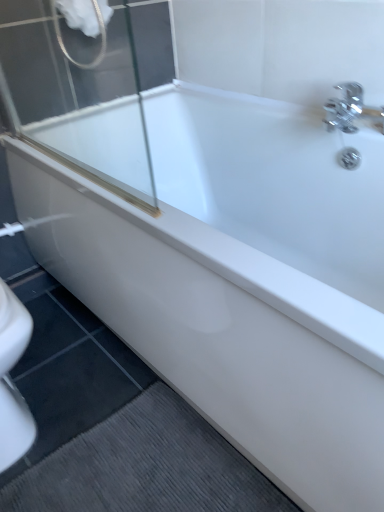
Locate an element on the screen. gray textured bath mat at lower left is located at coordinates pyautogui.click(x=146, y=466).

This screenshot has width=384, height=512. What do you see at coordinates (146, 466) in the screenshot? I see `gray textured bath mat at lower left` at bounding box center [146, 466].

Describe the element at coordinates (100, 32) in the screenshot. I see `white matte shower head at upper left` at that location.

At what (x,y) coordinates should I click in order to perform the action: click on white matte shower head at upper left. Please return your answer as a coordinate pair (x, y). Looking at the image, I should click on (100, 32).

The height and width of the screenshot is (512, 384). What are the coordinates of `gray textured bath mat at lower left` in the screenshot? It's located at (146, 466).

Considering the relative positions of white matte shower head at upper left and gray textured bath mat at lower left in the image provided, is white matte shower head at upper left to the right of gray textured bath mat at lower left from the viewer's perspective?

No.

Relative to gray textured bath mat at lower left, is white matte shower head at upper left in front or behind?

white matte shower head at upper left is behind gray textured bath mat at lower left.

Is point (56, 34) closer or farther from the camera than point (163, 479)?

Point (56, 34) appears to be farther away from the viewer than point (163, 479).

From the image's perspective, which one is positioned lower, white matte shower head at upper left or gray textured bath mat at lower left?

From the image's view, gray textured bath mat at lower left is below.

From a real-world perspective, which object rests below the other?

From a 3D spatial view, gray textured bath mat at lower left is below.

Looking at their sizes, would you say white matte shower head at upper left is wider or thinner than gray textured bath mat at lower left?

Clearly, white matte shower head at upper left has less width compared to gray textured bath mat at lower left.

Is white matte shower head at upper left taller than gray textured bath mat at lower left?

Indeed, white matte shower head at upper left has a greater height compared to gray textured bath mat at lower left.

Looking at the image, does white matte shower head at upper left seem bigger or smaller compared to gray textured bath mat at lower left?

white matte shower head at upper left is bigger than gray textured bath mat at lower left.

Based on the photo, do you think white matte shower head at upper left is within gray textured bath mat at lower left, or outside of it?

white matte shower head at upper left cannot be found inside gray textured bath mat at lower left.

Is white matte shower head at upper left not near gray textured bath mat at lower left?

That's right, there is a large distance between white matte shower head at upper left and gray textured bath mat at lower left.

Is white matte shower head at upper left facing towards gray textured bath mat at lower left?

No, white matte shower head at upper left is not turned towards gray textured bath mat at lower left.

How many degrees apart are the facing directions of white matte shower head at upper left and gray textured bath mat at lower left?

There is a 91.6-degree angle between the facing directions of white matte shower head at upper left and gray textured bath mat at lower left.

How distant is white matte shower head at upper left from gray textured bath mat at lower left?

1.23 meters.

Where is `shower above the gray textured bath mat at lower left (from the image's perspective)`? The image size is (384, 512). shower above the gray textured bath mat at lower left (from the image's perspective) is located at coordinates (100, 32).

From the picture: Which object is positioned more to the right, gray textured bath mat at lower left or white matte shower head at upper left?

Positioned to the right is gray textured bath mat at lower left.

Is gray textured bath mat at lower left behind white matte shower head at upper left?

No, gray textured bath mat at lower left is closer to the camera.

Does point (288, 508) come in front of point (104, 57)?

Yes, it is.

From the image's perspective, which object appears higher, gray textured bath mat at lower left or white matte shower head at upper left?

white matte shower head at upper left.

From a real-world perspective, does gray textured bath mat at lower left sit lower than white matte shower head at upper left?

Yes, from a real-world perspective, gray textured bath mat at lower left is below white matte shower head at upper left.

Considering the relative sizes of gray textured bath mat at lower left and white matte shower head at upper left in the image provided, is gray textured bath mat at lower left wider than white matte shower head at upper left?

Yes.

Who is taller, gray textured bath mat at lower left or white matte shower head at upper left?

white matte shower head at upper left.

Who is smaller, gray textured bath mat at lower left or white matte shower head at upper left?

gray textured bath mat at lower left.

Would you say gray textured bath mat at lower left is outside white matte shower head at upper left?

Absolutely, gray textured bath mat at lower left is external to white matte shower head at upper left.

Would you say gray textured bath mat at lower left is a long distance from white matte shower head at upper left?

gray textured bath mat at lower left is positioned a significant distance from white matte shower head at upper left.

In the scene shown: Is gray textured bath mat at lower left facing towards white matte shower head at upper left?

No.

What are the coordinates of `bath mat that is in front of the white matte shower head at upper left` in the screenshot? It's located at (146, 466).

You are a GUI agent. You are given a task and a screenshot of the screen. Output one action in this format:
    pyautogui.click(x=<x>, y=<y>)
    Task: Click on the bath mat lying on the right of white matte shower head at upper left
    Image resolution: width=384 pixels, height=512 pixels.
    Given the screenshot: What is the action you would take?
    pyautogui.click(x=146, y=466)

This screenshot has width=384, height=512. Identify the location of shower behind the gray textured bath mat at lower left. (100, 32).